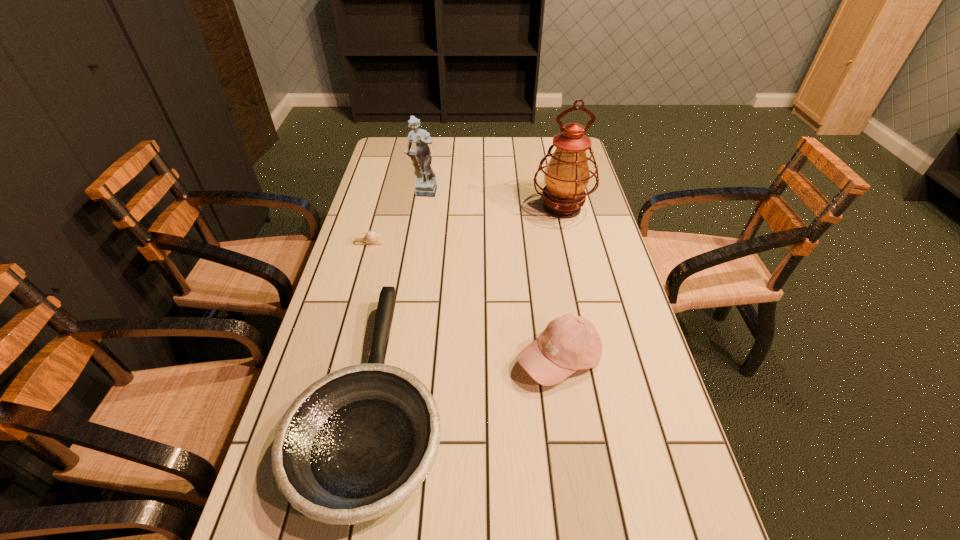
Identify the location of vacant space at the right edge of the desktop. (611, 333).

The height and width of the screenshot is (540, 960). Find the location of `vacant space at the far right corner`. vacant space at the far right corner is located at coordinates (547, 150).

At what (x,y) coordinates should I click in order to perform the action: click on vacant area between the second tallest object and the shortest object. Please return your answer as a coordinate pair (x, y). The width and height of the screenshot is (960, 540). Looking at the image, I should click on (395, 218).

This screenshot has width=960, height=540. I want to click on free spot between the oil lamp and the fourth shortest object, so click(x=492, y=200).

This screenshot has width=960, height=540. In order to click on free spot between the figurine and the tallest object in this screenshot , I will do `click(492, 200)`.

Locate an element on the screen. This screenshot has width=960, height=540. free space between the frying pan and the baseball cap is located at coordinates (468, 377).

Identify the location of vacant region between the baseball cap and the oil lamp. This screenshot has width=960, height=540. (561, 284).

At what (x,y) coordinates should I click in order to perform the action: click on vacant point located between the frying pan and the second tallest object. Please return your answer as a coordinate pair (x, y). Looking at the image, I should click on (398, 294).

Where is `empty space between the third shortest object and the oil lamp`? The height and width of the screenshot is (540, 960). empty space between the third shortest object and the oil lamp is located at coordinates (561, 284).

Find the location of a particular element. vacant space in between the third tallest object and the second shortest object is located at coordinates (x=468, y=377).